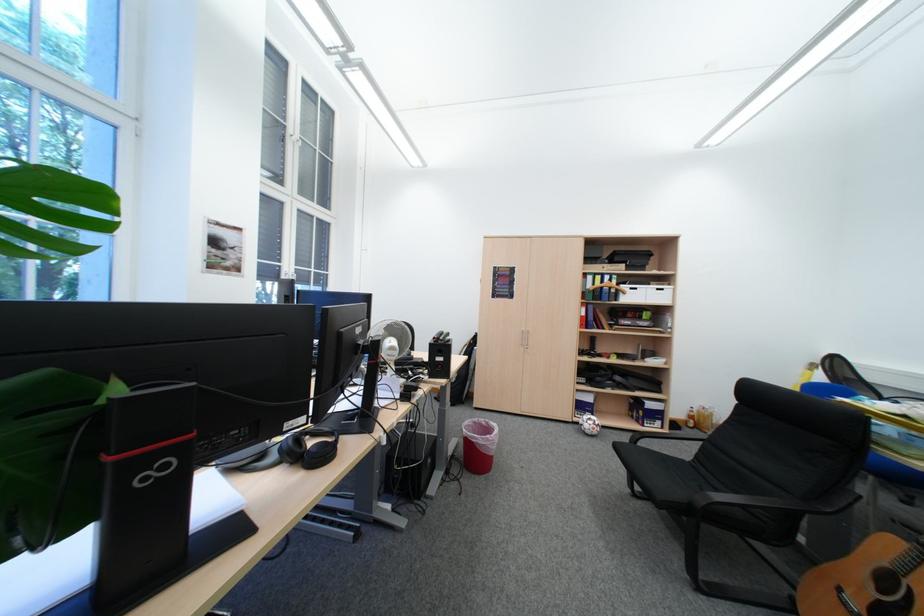
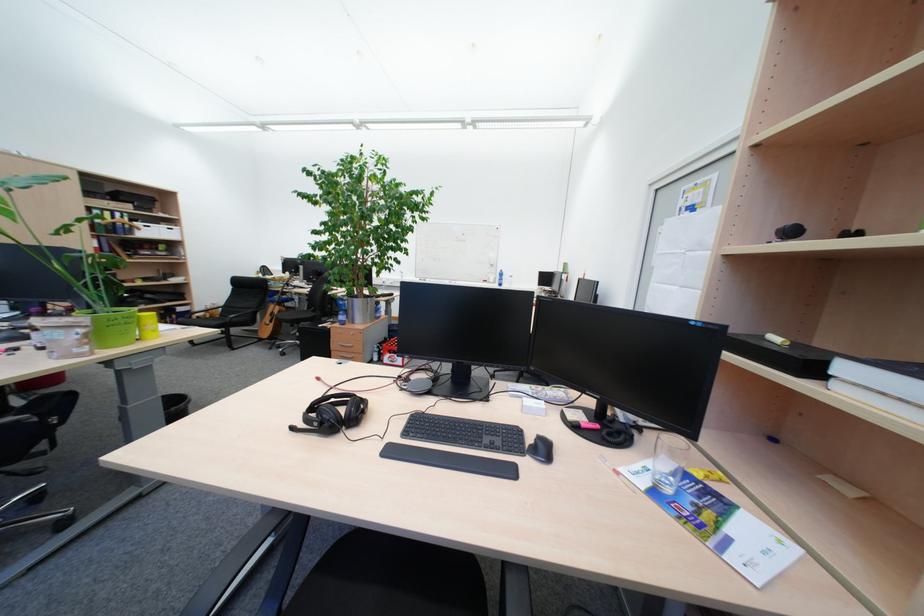
Where in the second image is the point corresponding to (712,501) from the first image?

(239, 321)